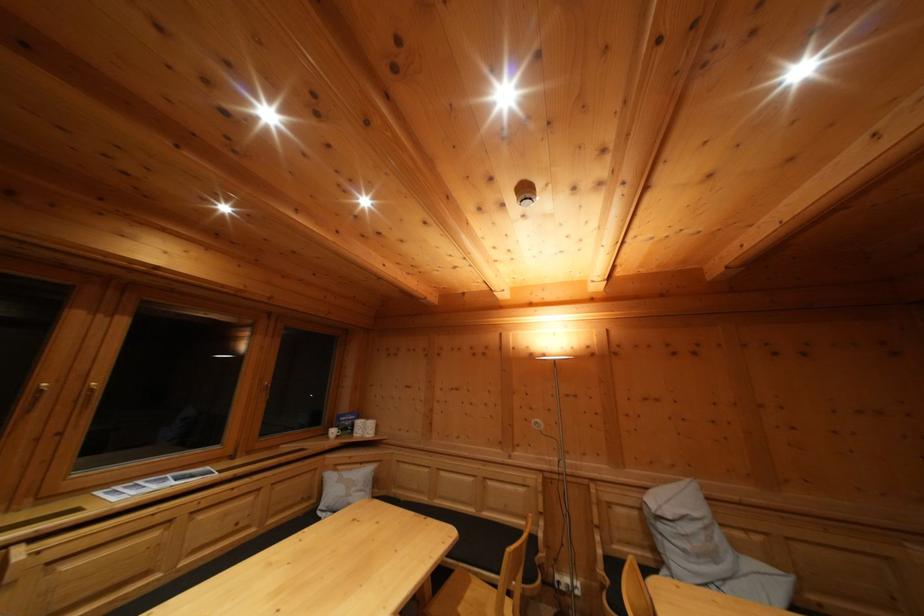
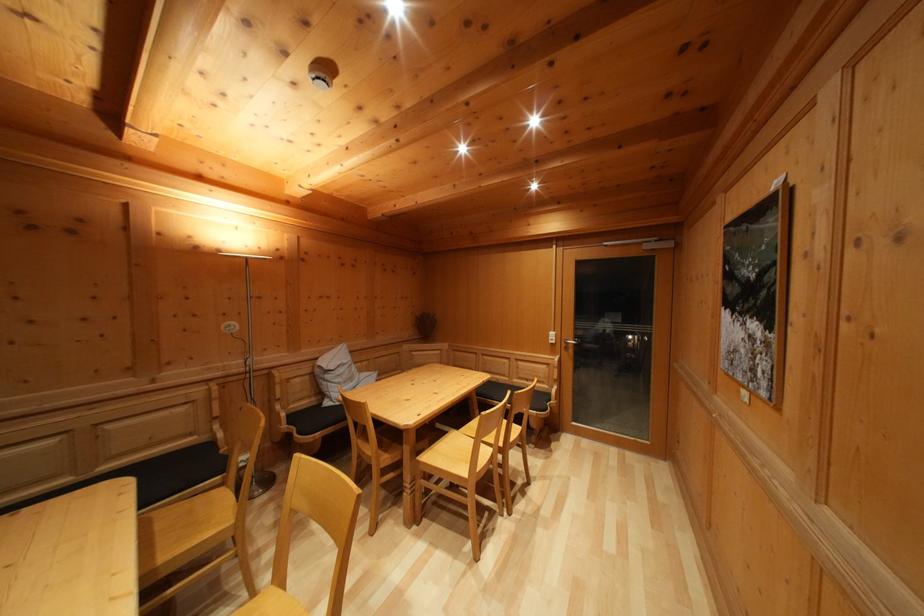
Question: How did the camera likely rotate?

Choices:
 (A) Left
 (B) Right
 (C) Up
 (D) Down

Answer: (B)